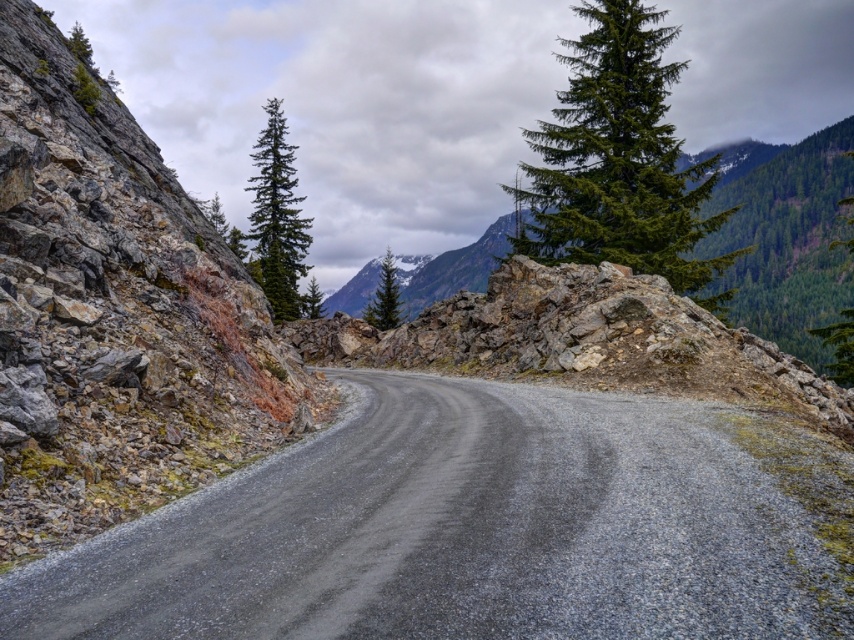
In the scene shown: You are a hiker planning to cross the winding gravel road. You see the rocky gray at left and the green matte evergreen tree at center. Which object is narrower in width?

The rocky gray at left is thinner than the green matte evergreen tree at center, so the rocky gray at left is narrower in width.